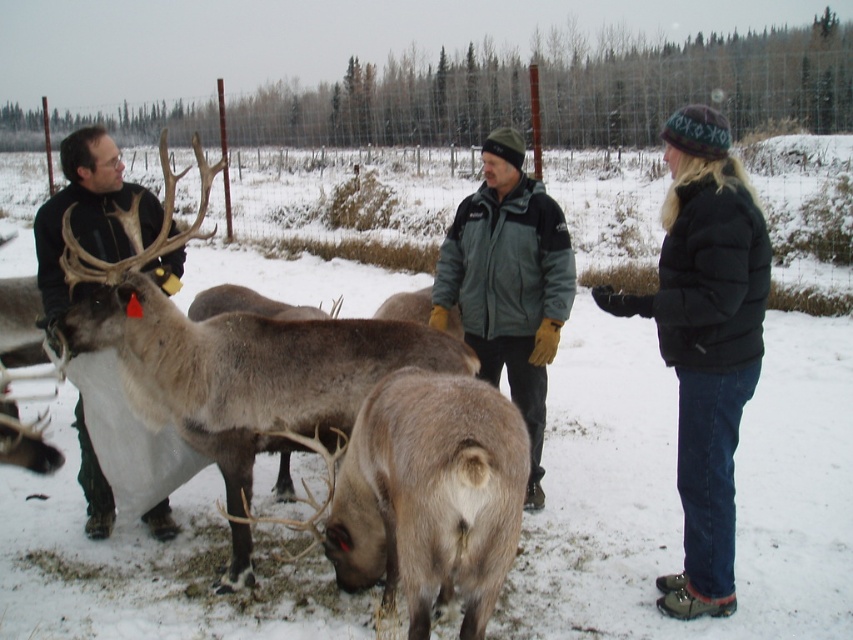
You are a photographer positioned at the back of the fenced area. You want to take a photo that includes both the black puffy jacket at right and the matte black jacket at left. Which jacket should you focus on first to ensure both are in the frame?

The matte black jacket at left is higher up, so focus on it first to ensure the black puffy jacket at right below it is also captured in the frame.

You are standing in the snowy outdoor scene with three people and reindeer. You need to determine which of the two points, point [506,250] or point [152,220], is closer to you. Which one is closer?

Point [152,220] is closer to you because it is less further to the camera than point [506,250].